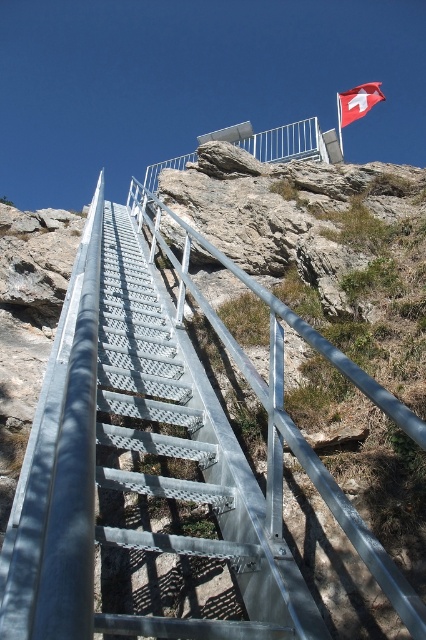
Question: Is metallic silver rail at upper center thinner than red fabric flag at upper right?

Choices:
 (A) yes
 (B) no

Answer: (A)

Question: Is metallic silver rail at upper center below red fabric flag at upper right?

Choices:
 (A) no
 (B) yes

Answer: (B)

Question: Which point is closer to the camera?

Choices:
 (A) (368, 108)
 (B) (152, 428)

Answer: (B)

Question: Can you confirm if metallic silver rail at upper center is positioned below red fabric flag at upper right?

Choices:
 (A) no
 (B) yes

Answer: (B)

Question: Among these points, which one is farthest from the camera?

Choices:
 (A) (377, 92)
 (B) (184, 362)

Answer: (A)